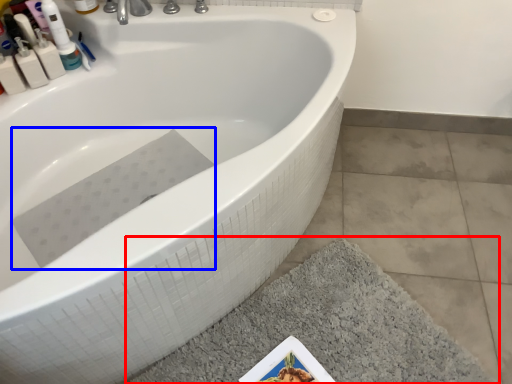
Question: Which point is closer to the camera, bath mat (highlighted by a red box) or bath towel (highlighted by a blue box)?

Choices:
 (A) bath mat
 (B) bath towel

Answer: (A)